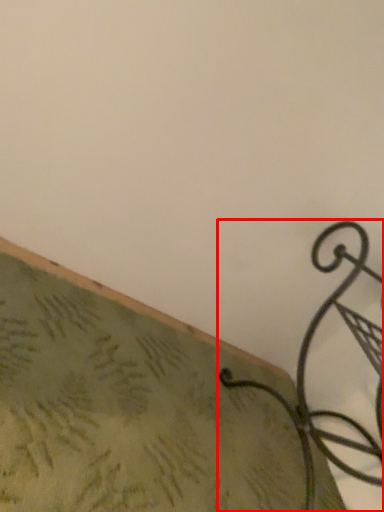
Question: From the image's perspective, considering the relative positions of furniture (annotated by the red box) and surface in the image provided, where is furniture (annotated by the red box) located with respect to the staircase?

Choices:
 (A) above
 (B) below

Answer: (A)